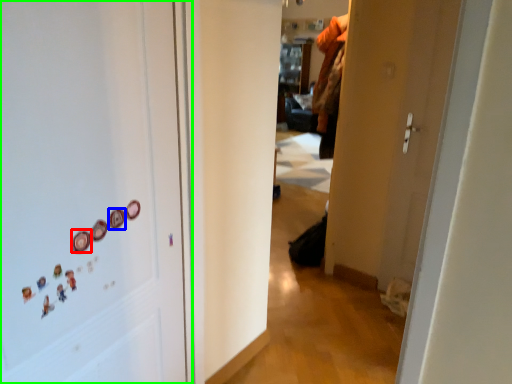
Question: Based on their relative distances, which object is nearer to button (highlighted by a red box)? Choose from button (highlighted by a blue box) and door (highlighted by a green box).

Choices:
 (A) button
 (B) door

Answer: (A)